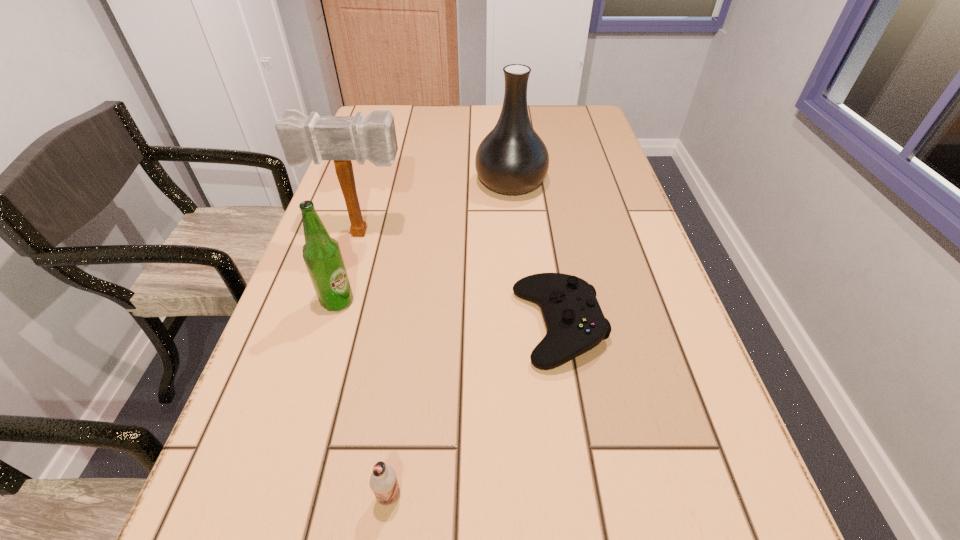
Find the location of a particular element. vase is located at coordinates (512, 159).

Identify the location of mallet. 340,138.

Locate an element on the screen. The image size is (960, 540). beer bottle is located at coordinates (321, 253).

Where is `the second shortest object`? the second shortest object is located at coordinates (383, 482).

At what (x,y) coordinates should I click in order to perform the action: click on the third object from left to right. Please return your answer as a coordinate pair (x, y). Looking at the image, I should click on (383, 482).

Locate an element on the screen. The image size is (960, 540). control is located at coordinates (575, 323).

The width and height of the screenshot is (960, 540). I want to click on vacant point located 0.160m on the back of the farthest object, so click(507, 137).

Identify the location of free location located 0.170m on the back of the mallet. (376, 186).

The image size is (960, 540). I want to click on vacant region located 0.290m on the label of the third tallest object, so click(500, 302).

Image resolution: width=960 pixels, height=540 pixels. Identify the location of vacant space located on the back of the third object from left to right. (400, 418).